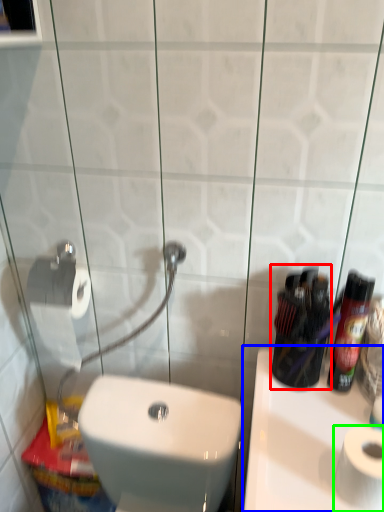
Question: Based on their relative distances, which object is nearer to mouthwash (highlighted by a red box)? Choose from sink (highlighted by a blue box) and toilet paper (highlighted by a green box).

Choices:
 (A) sink
 (B) toilet paper

Answer: (A)